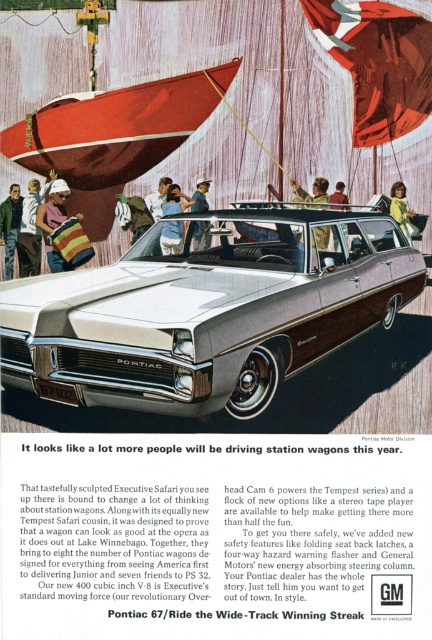
Does silver metallic station wagon at center have a larger size compared to blue denim jeans at center?

Correct, silver metallic station wagon at center is larger in size than blue denim jeans at center.

Does silver metallic station wagon at center appear over blue denim jeans at center?

Actually, silver metallic station wagon at center is below blue denim jeans at center.

What do you see at coordinates (206, 310) in the screenshot? I see `silver metallic station wagon at center` at bounding box center [206, 310].

This screenshot has height=640, width=432. Find the location of `silver metallic station wagon at center`. silver metallic station wagon at center is located at coordinates (206, 310).

Does green fabric jacket at lower left have a larger size compared to blue denim jeans at center?

No, green fabric jacket at lower left is not bigger than blue denim jeans at center.

Does green fabric jacket at lower left have a lesser width compared to blue denim jeans at center?

No, green fabric jacket at lower left is not thinner than blue denim jeans at center.

The image size is (432, 640). I want to click on green fabric jacket at lower left, so click(9, 227).

Does striped fabric bag at lower left have a smaller size compared to denim jacket at center?

Incorrect, striped fabric bag at lower left is not smaller in size than denim jacket at center.

Who is positioned more to the left, striped fabric bag at lower left or denim jacket at center?

Positioned to the left is striped fabric bag at lower left.

Where is `striped fabric bag at lower left`? Image resolution: width=432 pixels, height=640 pixels. striped fabric bag at lower left is located at coordinates (31, 227).